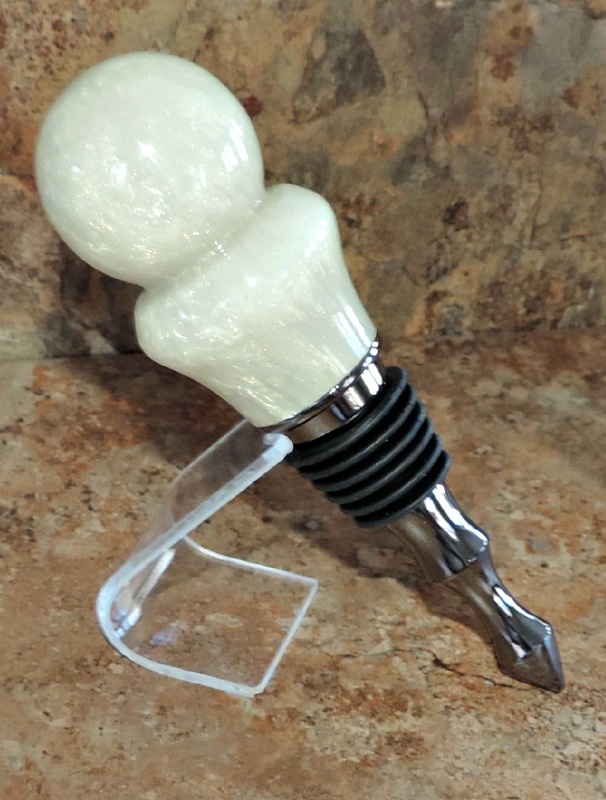
Where is `knob`? knob is located at coordinates (113, 130).